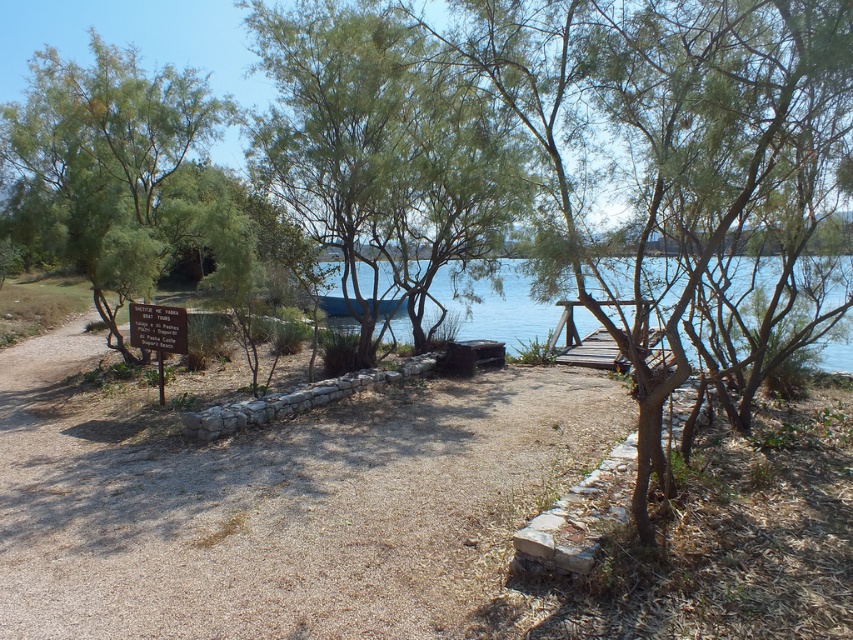
Can you confirm if brown gravel path at center is shorter than white wooden sign at lower left?

No.

Is brown gravel path at center wider than white wooden sign at lower left?

Indeed, brown gravel path at center has a greater width compared to white wooden sign at lower left.

Between point (387, 596) and point (144, 310), which one is positioned behind?

The point (144, 310) is behind.

I want to click on brown gravel path at center, so click(x=277, y=500).

Between brown gravel path at center and blue water at center, which one appears on the right side from the viewer's perspective?

blue water at center

Is point (19, 493) positioned before point (517, 339)?

Yes.

Where is `brown gravel path at center`? The height and width of the screenshot is (640, 853). brown gravel path at center is located at coordinates (277, 500).

Which is more to the right, blue water at center or white wooden sign at lower left?

blue water at center is more to the right.

Between point (511, 348) and point (137, 328), which one is positioned behind?

Point (511, 348)

Which is in front, point (848, 360) or point (171, 310)?

Point (171, 310) is in front.

The height and width of the screenshot is (640, 853). I want to click on blue water at center, so click(x=498, y=307).